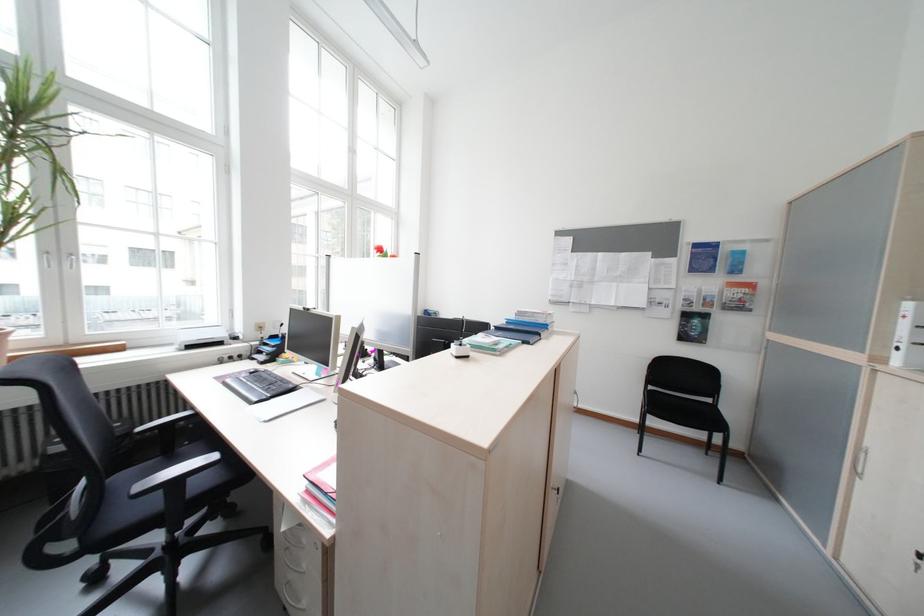
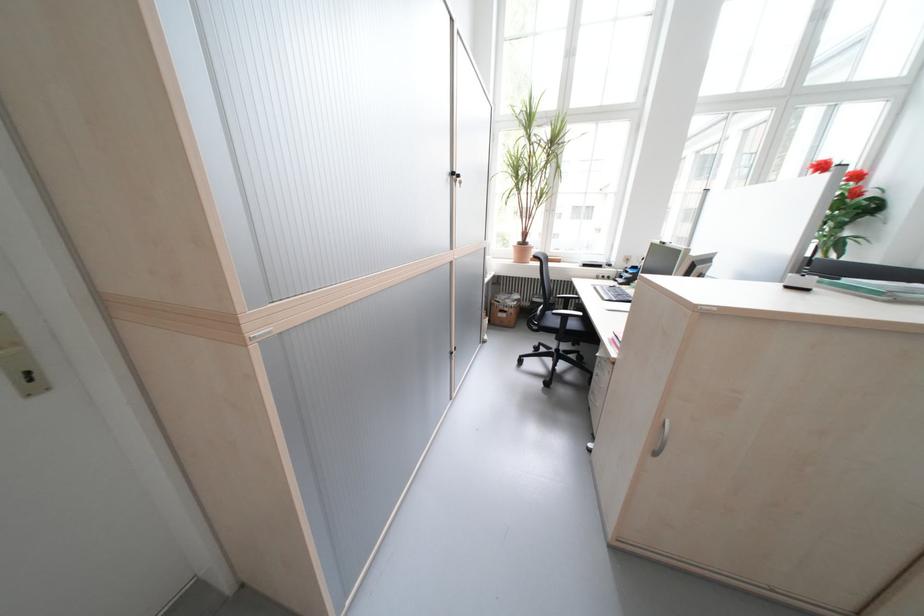
Locate, in the second image, the point that corresponds to pixel 186 484 in the first image.

(575, 318)